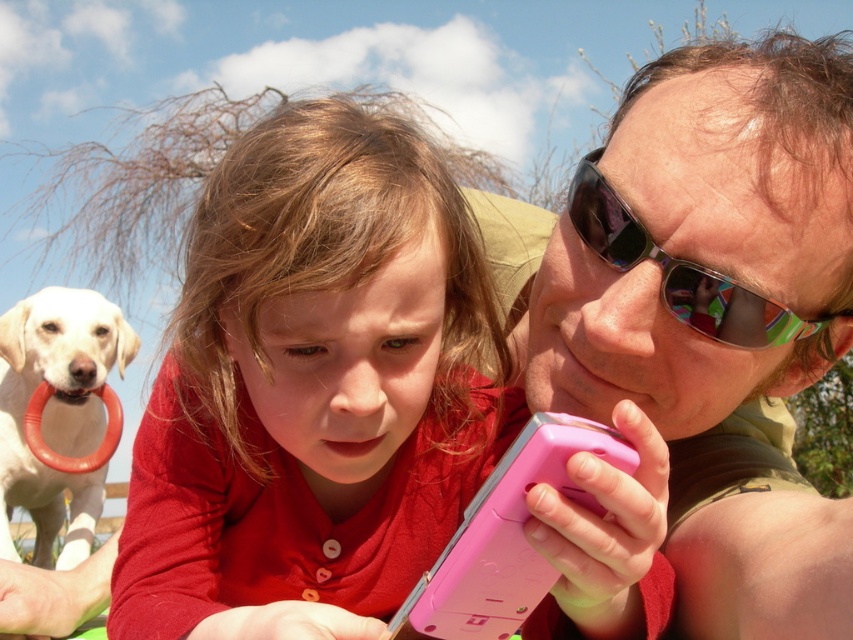
Looking at this image, you are a photographer trying to capture a photo of the matte pink phone at center and the black reflective sunglasses at upper right. From the photographer perspective, which object is positioned to the left?

The matte pink phone at center is positioned to the left of the black reflective sunglasses at upper right.

You are a photographer trying to capture a clear shot of the pink plastic smartphone at center and the black reflective sunglasses at upper right. Since you need to focus on the thinner object first, which one should you adjust your camera settings for first?

The pink plastic smartphone at center is thinner than the black reflective sunglasses at upper right, so you should adjust your camera settings for the pink plastic smartphone at center first.